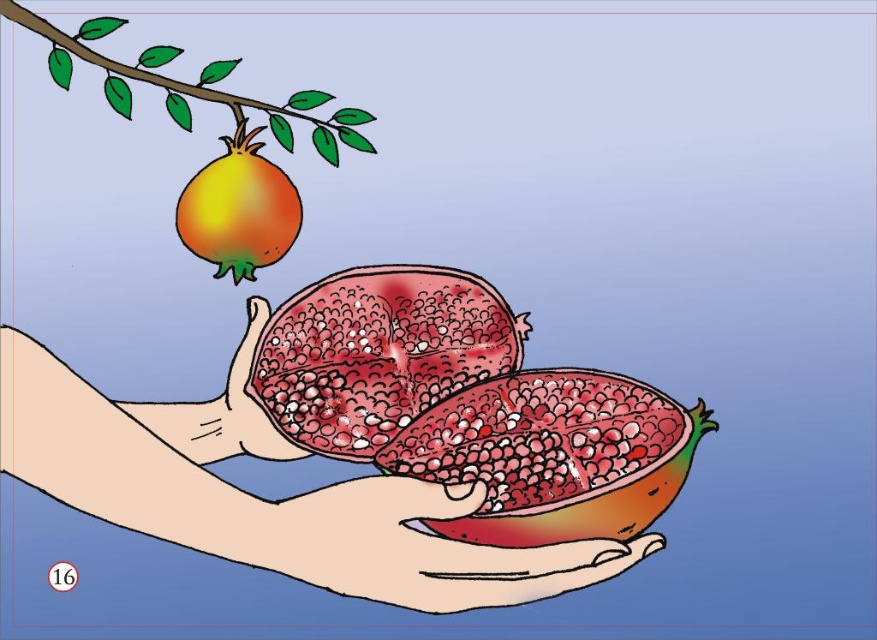
Question: Can you confirm if smooth red pomegranate halves at center is smaller than shiny orange pomegranate at upper left?

Choices:
 (A) no
 (B) yes

Answer: (A)

Question: Does smooth red pomegranate at center have a lesser width compared to smooth skin hand at center?

Choices:
 (A) no
 (B) yes

Answer: (A)

Question: Which object is the closest to the smooth red pomegranate at center?

Choices:
 (A) green leafy branch at upper left
 (B) smooth skin hand at lower center

Answer: (B)

Question: Which point is closer to the camera taking this photo?

Choices:
 (A) (383, 320)
 (B) (252, 346)
 (C) (201, 237)
 (D) (86, 35)

Answer: (B)

Question: Which is farther from the smooth skin hand at lower center?

Choices:
 (A) green leafy branch at upper left
 (B) shiny orange pomegranate at upper left
 (C) semi-glossy red pomegranate at center

Answer: (A)

Question: Does semi-glossy red pomegranate at center appear on the right side of smooth skin hand at lower center?

Choices:
 (A) yes
 (B) no

Answer: (B)